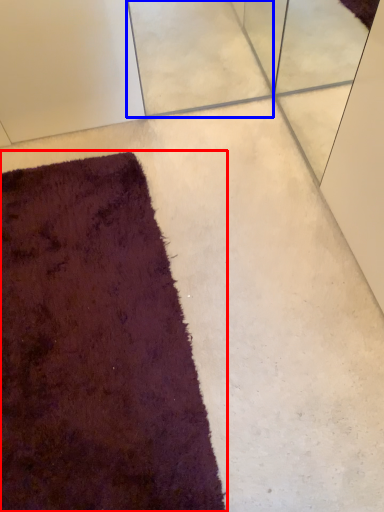
Question: Which of the following is the closest to the observer, towel (highlighted by a red box) or concrete (highlighted by a blue box)?

Choices:
 (A) towel
 (B) concrete

Answer: (A)